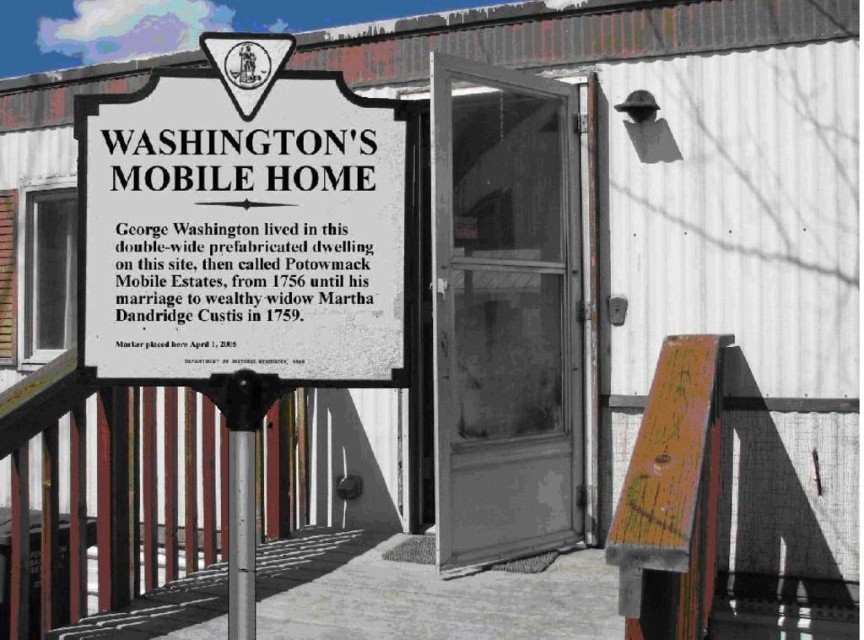
Can you confirm if white paper sign at upper left is shorter than wooden painted bench at lower right?

Yes.

At what (x,y) coordinates should I click in order to perform the action: click on white paper sign at upper left. Please return your answer as a coordinate pair (x, y). Looking at the image, I should click on (240, 232).

In order to click on white paper sign at upper left in this screenshot , I will do `click(240, 232)`.

Who is more forward, (681, 634) or (230, 540)?

Point (230, 540) is more forward.

This screenshot has height=640, width=864. I want to click on wooden painted bench at lower right, so click(x=671, y=497).

Is point (636, 531) closer to viewer compared to point (242, 444)?

No, (636, 531) is further to viewer.

Image resolution: width=864 pixels, height=640 pixels. In order to click on wooden painted bench at lower right in this screenshot , I will do `click(671, 497)`.

Is white paper sign at upper left further to camera compared to silver metallic pole at left?

No, white paper sign at upper left is in front of silver metallic pole at left.

Who is more distant from viewer, (x=148, y=193) or (x=243, y=490)?

Point (x=243, y=490)

Is point (392, 122) in front of point (234, 497)?

No, (392, 122) is further to viewer.

Find the location of a particular element. The image size is (864, 640). white paper sign at upper left is located at coordinates (240, 232).